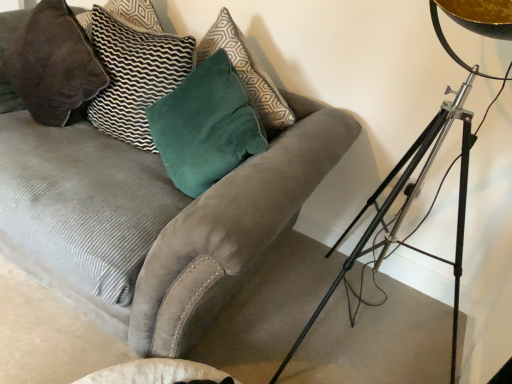
Image resolution: width=512 pixels, height=384 pixels. What do you see at coordinates (53, 64) in the screenshot?
I see `velvet dark brown pillow at upper left, positioned as the 1th pillow in left-to-right order` at bounding box center [53, 64].

Describe the element at coordinates (169, 221) in the screenshot. This screenshot has width=512, height=384. I see `velvet gray couch at center` at that location.

This screenshot has width=512, height=384. What are the coordinates of `velvet green pillow at upper left, the first pillow from the right` in the screenshot? It's located at (134, 76).

Looking at their sizes, would you say velvet green pillow at upper left, the first pillow from the right, is wider or thinner than metallic tripod at right?

velvet green pillow at upper left, the first pillow from the right, is thinner than metallic tripod at right.

From a real-world perspective, which is physically below, velvet green pillow at upper left, the second pillow positioned from the left, or metallic tripod at right?

In real-world perspective, metallic tripod at right is lower.

Which object is more forward, velvet green pillow at upper left, the second pillow positioned from the left, or metallic tripod at right?

metallic tripod at right is in front.

Could you tell me if velvet green pillow at upper left, the second pillow positioned from the left, is turned towards metallic tripod at right?

No, velvet green pillow at upper left, the second pillow positioned from the left, does not turn towards metallic tripod at right.

Which object is positioned more to the left, velvet dark brown pillow at upper left, the second pillow from the right, or velvet gray couch at center?

velvet dark brown pillow at upper left, the second pillow from the right.

Is velvet dark brown pillow at upper left, positioned as the 1th pillow in left-to-right order, positioned with its back to velvet gray couch at center?

Correct, velvet dark brown pillow at upper left, positioned as the 1th pillow in left-to-right order, is looking away from velvet gray couch at center.

Who is more distant, velvet dark brown pillow at upper left, the second pillow from the right, or velvet gray couch at center?

velvet dark brown pillow at upper left, the second pillow from the right.

Is velvet dark brown pillow at upper left, the second pillow from the right, with velvet gray couch at center?

velvet dark brown pillow at upper left, the second pillow from the right, and velvet gray couch at center are not in contact.

Could you tell me if velvet dark brown pillow at upper left, positioned as the 1th pillow in left-to-right order, is facing velvet green pillow at upper left, the second pillow positioned from the left?

No, velvet dark brown pillow at upper left, positioned as the 1th pillow in left-to-right order, is not turned towards velvet green pillow at upper left, the second pillow positioned from the left.

Are velvet dark brown pillow at upper left, the second pillow from the right, and velvet green pillow at upper left, the second pillow positioned from the left, far apart?

They are positioned close to each other.

From the image's perspective, which object appears higher, velvet gray couch at center or velvet dark brown pillow at upper left, the second pillow from the right?

velvet dark brown pillow at upper left, the second pillow from the right, from the image's perspective.

In the image, there is a velvet dark brown pillow at upper left, the second pillow from the right. At what (x,y) coordinates should I click in order to perform the action: click on studio couch below it (from a real-world perspective). Please return your answer as a coordinate pair (x, y). Looking at the image, I should click on (169, 221).

Considering the positions of objects velvet gray couch at center and velvet dark brown pillow at upper left, the second pillow from the right, in the image provided, who is more to the left, velvet gray couch at center or velvet dark brown pillow at upper left, the second pillow from the right,?

From the viewer's perspective, velvet dark brown pillow at upper left, the second pillow from the right, appears more on the left side.

Is metallic tripod at right at the left side of velvet dark brown pillow at upper left, positioned as the 1th pillow in left-to-right order?

Incorrect, metallic tripod at right is not on the left side of velvet dark brown pillow at upper left, positioned as the 1th pillow in left-to-right order.

Can you tell me how much metallic tripod at right and velvet dark brown pillow at upper left, the second pillow from the right, differ in facing direction?

The facing directions of metallic tripod at right and velvet dark brown pillow at upper left, the second pillow from the right, are 34.9 degrees apart.

Is point (455, 296) closer or farther from the camera than point (67, 23)?

Point (455, 296) appears to be closer to the viewer than point (67, 23).

Is metallic tripod at right positioned with its back to velvet dark brown pillow at upper left, the second pillow from the right?

No.

Would you say velvet gray couch at center is a long distance from metallic tripod at right?

No, velvet gray couch at center is not far from metallic tripod at right.

Is velvet gray couch at center bigger or smaller than metallic tripod at right?

Clearly, velvet gray couch at center is larger in size than metallic tripod at right.

Would you say velvet gray couch at center is inside or outside metallic tripod at right?

velvet gray couch at center cannot be found inside metallic tripod at right.

Considering the relative positions of velvet gray couch at center and metallic tripod at right in the image provided, is velvet gray couch at center in front of metallic tripod at right?

No, velvet gray couch at center is further to the viewer.

The height and width of the screenshot is (384, 512). In order to click on pillow on the right of velvet gray couch at center in this screenshot , I will do `click(134, 76)`.

Who is smaller, velvet gray couch at center or velvet green pillow at upper left, the second pillow positioned from the left?

velvet green pillow at upper left, the second pillow positioned from the left.

Is velvet gray couch at center next to velvet green pillow at upper left, the first pillow from the right?

No, velvet gray couch at center is not in contact with velvet green pillow at upper left, the first pillow from the right.

Where is `tripod lying on the right of velvet green pillow at upper left, the second pillow positioned from the left`? This screenshot has height=384, width=512. tripod lying on the right of velvet green pillow at upper left, the second pillow positioned from the left is located at coordinates (409, 206).

The width and height of the screenshot is (512, 384). What are the coordinates of `the 2nd pillow above the velvet gray couch at center (from the image's perspective)` in the screenshot? It's located at (53, 64).

Considering their positions, is velvet green pillow at upper left, the second pillow positioned from the left, positioned further to velvet dark brown pillow at upper left, positioned as the 1th pillow in left-to-right order, than velvet gray couch at center?

Among the two, velvet gray couch at center is located further to velvet dark brown pillow at upper left, positioned as the 1th pillow in left-to-right order.

From the image, which object appears to be nearer to metallic tripod at right, velvet dark brown pillow at upper left, positioned as the 1th pillow in left-to-right order, or velvet gray couch at center?

The object closer to metallic tripod at right is velvet gray couch at center.

Which object lies further to the anchor point velvet gray couch at center, velvet green pillow at upper left, the second pillow positioned from the left, or velvet dark brown pillow at upper left, positioned as the 1th pillow in left-to-right order?

The object further to velvet gray couch at center is velvet dark brown pillow at upper left, positioned as the 1th pillow in left-to-right order.

Considering their positions, is velvet green pillow at upper left, the first pillow from the right, positioned further to metallic tripod at right than velvet gray couch at center?

velvet green pillow at upper left, the first pillow from the right, is further to metallic tripod at right.

Considering their positions, is velvet gray couch at center positioned closer to metallic tripod at right than velvet dark brown pillow at upper left, positioned as the 1th pillow in left-to-right order?

Among the two, velvet gray couch at center is located nearer to metallic tripod at right.

When comparing their distances from velvet green pillow at upper left, the second pillow positioned from the left, does velvet gray couch at center or metallic tripod at right seem closer?

velvet gray couch at center is positioned closer to the anchor velvet green pillow at upper left, the second pillow positioned from the left.

Based on the photo, when comparing their distances from velvet green pillow at upper left, the first pillow from the right, does velvet dark brown pillow at upper left, positioned as the 1th pillow in left-to-right order, or velvet gray couch at center seem closer?

Based on the image, velvet dark brown pillow at upper left, positioned as the 1th pillow in left-to-right order, appears to be nearer to velvet green pillow at upper left, the first pillow from the right.

Considering their positions, is metallic tripod at right positioned further to velvet dark brown pillow at upper left, the second pillow from the right, than velvet green pillow at upper left, the second pillow positioned from the left?

Among the two, metallic tripod at right is located further to velvet dark brown pillow at upper left, the second pillow from the right.

This screenshot has height=384, width=512. In order to click on studio couch between velvet dark brown pillow at upper left, positioned as the 1th pillow in left-to-right order, and metallic tripod at right from left to right in this screenshot , I will do `click(169, 221)`.

Find the location of `pillow between velvet dark brown pillow at upper left, the second pillow from the right, and metallic tripod at right, in the horizontal direction`. pillow between velvet dark brown pillow at upper left, the second pillow from the right, and metallic tripod at right, in the horizontal direction is located at coordinates (134, 76).

You are a GUI agent. You are given a task and a screenshot of the screen. Output one action in this format:
    pyautogui.click(x=<x>, y=<y>)
    Task: Click on the pillow located between velvet gray couch at center and velvet green pillow at upper left, the second pillow positioned from the left, in the depth direction
    This screenshot has height=384, width=512.
    Given the screenshot: What is the action you would take?
    tap(53, 64)

I want to click on pillow situated between velvet gray couch at center and metallic tripod at right from left to right, so click(134, 76).